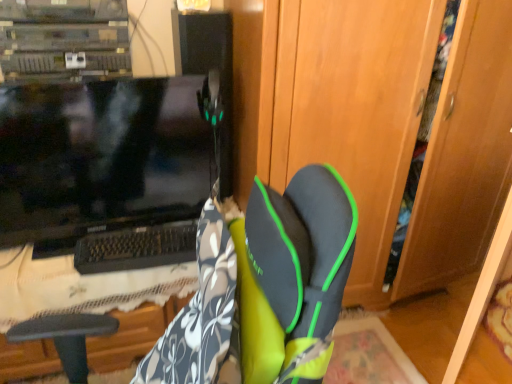
Find the location of a particular element. The width and height of the screenshot is (512, 384). vacant space situated above black glossy monitor at left (from a real-world perspective) is located at coordinates (50, 82).